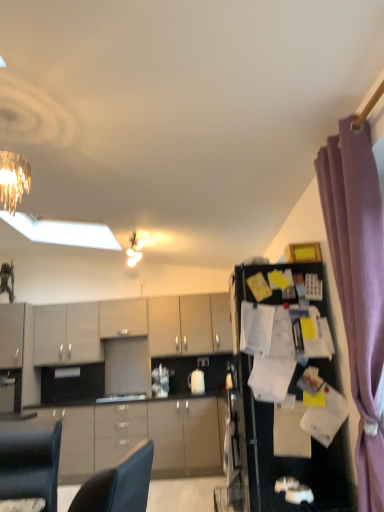
Identify the location of purple fabric curtain at right. This screenshot has width=384, height=512. (358, 287).

The image size is (384, 512). What do you see at coordinates (66, 334) in the screenshot?
I see `matte gray cabinets at center, which is counted as the 3th cabinetry, starting from the top` at bounding box center [66, 334].

At what (x,y) coordinates should I click in order to perform the action: click on glossy wood cabinets at center, the 4th cabinetry in the top-to-bottom sequence. Please return your answer as a coordinate pair (x, y). The image size is (384, 512). Looking at the image, I should click on (140, 436).

Find the location of a particular element. The width and height of the screenshot is (384, 512). white paper at right is located at coordinates (274, 426).

Describe the element at coordinates (133, 251) in the screenshot. This screenshot has height=512, width=384. I see `metallic chandelier at upper center` at that location.

What do you see at coordinates (123, 318) in the screenshot? I see `matte gray cabinet at center, the 4th cabinetry when ordered from bottom to top` at bounding box center [123, 318].

Measure the distance between matte gray cabinet at center, the 4th cabinetry when ordered from bottom to top, and camera.

They are 5.93 meters apart.

This screenshot has width=384, height=512. I want to click on purple fabric curtain at right, so click(x=358, y=287).

Consider the image. Between metallic chandelier at upper center and matte gray cabinet at center, placed as the first cabinetry when sorted from top to bottom, which one is positioned behind?

matte gray cabinet at center, placed as the first cabinetry when sorted from top to bottom.

Is metallic chandelier at upper center with matte gray cabinet at center, the 4th cabinetry when ordered from bottom to top?

metallic chandelier at upper center and matte gray cabinet at center, the 4th cabinetry when ordered from bottom to top, are not in contact.

From the image's perspective, between metallic chandelier at upper center and matte gray cabinet at center, placed as the first cabinetry when sorted from top to bottom, which one is located above?

metallic chandelier at upper center appears higher in the image.

How different are the orientations of metallic chandelier at upper center and matte gray cabinet at center, placed as the first cabinetry when sorted from top to bottom, in degrees?

82.4 degrees separate the facing orientations of metallic chandelier at upper center and matte gray cabinet at center, placed as the first cabinetry when sorted from top to bottom.

From a real-world perspective, which is physically below, purple fabric curtain at right or matte gray cabinets at center, which is counted as the 3th cabinetry, starting from the top?

purple fabric curtain at right is physically lower.

Which object is thinner, purple fabric curtain at right or matte gray cabinets at center, which is the 2th cabinetry from bottom to top?

purple fabric curtain at right.

Does purple fabric curtain at right lie behind matte gray cabinets at center, which is counted as the 3th cabinetry, starting from the top?

No, purple fabric curtain at right is closer to the viewer.

Are purple fabric curtain at right and matte gray cabinets at center, which is the 2th cabinetry from bottom to top, located far from each other?

Yes, purple fabric curtain at right is far from matte gray cabinets at center, which is the 2th cabinetry from bottom to top.

Who is bigger, matte gray cabinets at center, which is the 2th cabinetry from bottom to top, or matte gray cabinets at center, positioned as the 3th cabinetry in bottom-to-top order?

matte gray cabinets at center, positioned as the 3th cabinetry in bottom-to-top order, is bigger.

Which point is more distant from viewer, [38,359] or [168,335]?

The point [168,335] is behind.

Considering the relative sizes of matte gray cabinets at center, which is counted as the 3th cabinetry, starting from the top, and matte gray cabinets at center, positioned as the 3th cabinetry in bottom-to-top order, in the image provided, is matte gray cabinets at center, which is counted as the 3th cabinetry, starting from the top, wider than matte gray cabinets at center, positioned as the 3th cabinetry in bottom-to-top order,?

In fact, matte gray cabinets at center, which is counted as the 3th cabinetry, starting from the top, might be narrower than matte gray cabinets at center, positioned as the 3th cabinetry in bottom-to-top order.

Relative to white paper at right, is matte gray cabinet at center, placed as the first cabinetry when sorted from top to bottom, in front or behind?

Visually, matte gray cabinet at center, placed as the first cabinetry when sorted from top to bottom, is located behind white paper at right.

Is white paper at right inside matte gray cabinet at center, the 4th cabinetry when ordered from bottom to top?

Actually, white paper at right is outside matte gray cabinet at center, the 4th cabinetry when ordered from bottom to top.

From the image's perspective, between matte gray cabinet at center, the 4th cabinetry when ordered from bottom to top, and white paper at right, which one is located above?

matte gray cabinet at center, the 4th cabinetry when ordered from bottom to top, is shown above in the image.

Considering the relative sizes of matte gray cabinets at center, positioned as the 3th cabinetry in bottom-to-top order, and matte gray cabinets at center, which is the 2th cabinetry from bottom to top, in the image provided, is matte gray cabinets at center, positioned as the 3th cabinetry in bottom-to-top order, taller than matte gray cabinets at center, which is the 2th cabinetry from bottom to top,?

Yes, matte gray cabinets at center, positioned as the 3th cabinetry in bottom-to-top order, is taller than matte gray cabinets at center, which is the 2th cabinetry from bottom to top.

Looking at this image, can you confirm if matte gray cabinets at center, positioned as the 3th cabinetry in bottom-to-top order, is positioned to the left of matte gray cabinets at center, which is counted as the 3th cabinetry, starting from the top?

No.

Is matte gray cabinets at center, positioned as the 3th cabinetry in bottom-to-top order, turned away from matte gray cabinets at center, which is counted as the 3th cabinetry, starting from the top?

matte gray cabinets at center, positioned as the 3th cabinetry in bottom-to-top order, does not have its back to matte gray cabinets at center, which is counted as the 3th cabinetry, starting from the top.

Which of these two, matte gray cabinets at center, positioned as the 3th cabinetry in bottom-to-top order, or matte gray cabinets at center, which is counted as the 3th cabinetry, starting from the top, is wider?

Wider between the two is matte gray cabinets at center, positioned as the 3th cabinetry in bottom-to-top order.

Considering the sizes of objects glossy wood cabinets at center, the 4th cabinetry in the top-to-bottom sequence, and matte gray cabinets at center, which is counted as the 3th cabinetry, starting from the top, in the image provided, who is shorter, glossy wood cabinets at center, the 4th cabinetry in the top-to-bottom sequence, or matte gray cabinets at center, which is counted as the 3th cabinetry, starting from the top,?

Standing shorter between the two is matte gray cabinets at center, which is counted as the 3th cabinetry, starting from the top.

From the picture: Can you confirm if glossy wood cabinets at center, which is the 1th cabinetry in bottom-to-top order, is positioned to the right of matte gray cabinets at center, which is counted as the 3th cabinetry, starting from the top?

Indeed, glossy wood cabinets at center, which is the 1th cabinetry in bottom-to-top order, is positioned on the right side of matte gray cabinets at center, which is counted as the 3th cabinetry, starting from the top.

Relative to matte gray cabinets at center, which is the 2th cabinetry from bottom to top, is glossy wood cabinets at center, the 4th cabinetry in the top-to-bottom sequence, in front or behind?

glossy wood cabinets at center, the 4th cabinetry in the top-to-bottom sequence, is in front of matte gray cabinets at center, which is the 2th cabinetry from bottom to top.

Does point (194, 401) lie in front of point (77, 321)?

That is True.

Considering their positions, is purple fabric curtain at right located in front of or behind matte gray cabinets at center, positioned as the 3th cabinetry in bottom-to-top order?

purple fabric curtain at right is positioned closer to the viewer than matte gray cabinets at center, positioned as the 3th cabinetry in bottom-to-top order.

Can we say purple fabric curtain at right lies outside matte gray cabinets at center, positioned as the 3th cabinetry in bottom-to-top order?

Yes.

From the picture: Can you tell me how much purple fabric curtain at right and matte gray cabinets at center, positioned as the 3th cabinetry in bottom-to-top order, differ in facing direction?

They differ by 85.8 degrees in their facing directions.

Where is `light fixture that is above the matte gray cabinet at center, the 4th cabinetry when ordered from bottom to top (from a real-world perspective)`? This screenshot has height=512, width=384. light fixture that is above the matte gray cabinet at center, the 4th cabinetry when ordered from bottom to top (from a real-world perspective) is located at coordinates (133, 251).

Find the location of `curtain on the right side of matte gray cabinets at center, which is the 2th cabinetry from bottom to top`. curtain on the right side of matte gray cabinets at center, which is the 2th cabinetry from bottom to top is located at coordinates (358, 287).

Looking at the image, which one is located further to glossy wood cabinets at center, the 4th cabinetry in the top-to-bottom sequence, matte gray cabinets at center, which is counted as the 3th cabinetry, starting from the top, or metallic chandelier at upper center?

metallic chandelier at upper center lies further to glossy wood cabinets at center, the 4th cabinetry in the top-to-bottom sequence, than the other object.

Looking at the image, which one is located further to matte gray cabinet at center, the 4th cabinetry when ordered from bottom to top, glossy wood cabinets at center, which is the 1th cabinetry in bottom-to-top order, or matte gray cabinets at center, which is the 2th cabinetry from bottom to top?

The object further to matte gray cabinet at center, the 4th cabinetry when ordered from bottom to top, is glossy wood cabinets at center, which is the 1th cabinetry in bottom-to-top order.

Estimate the real-world distances between objects in this image. Which object is closer to purple fabric curtain at right, glossy wood cabinets at center, which is the 1th cabinetry in bottom-to-top order, or white paper at right?

Based on the image, white paper at right appears to be nearer to purple fabric curtain at right.

When comparing their distances from white paper at right, does matte gray cabinets at center, positioned as the 3th cabinetry in bottom-to-top order, or glossy wood cabinets at center, the 4th cabinetry in the top-to-bottom sequence, seem closer?

glossy wood cabinets at center, the 4th cabinetry in the top-to-bottom sequence, is positioned closer to the anchor white paper at right.

When comparing their distances from matte gray cabinets at center, acting as the second cabinetry starting from the top, does purple fabric curtain at right or matte gray cabinets at center, which is the 2th cabinetry from bottom to top, seem further?

purple fabric curtain at right lies further to matte gray cabinets at center, acting as the second cabinetry starting from the top, than the other object.

Looking at the image, which one is located further to matte gray cabinets at center, which is counted as the 3th cabinetry, starting from the top, glossy wood cabinets at center, which is the 1th cabinetry in bottom-to-top order, or metallic chandelier at upper center?

Among the two, metallic chandelier at upper center is located further to matte gray cabinets at center, which is counted as the 3th cabinetry, starting from the top.

When comparing their distances from glossy wood cabinets at center, the 4th cabinetry in the top-to-bottom sequence, does purple fabric curtain at right or matte gray cabinets at center, which is the 2th cabinetry from bottom to top, seem further?

purple fabric curtain at right is positioned further to the anchor glossy wood cabinets at center, the 4th cabinetry in the top-to-bottom sequence.

Considering their positions, is matte gray cabinets at center, acting as the second cabinetry starting from the top, positioned closer to white paper at right than purple fabric curtain at right?

purple fabric curtain at right is positioned closer to the anchor white paper at right.

Find the location of a particular element. light fixture between purple fabric curtain at right and glossy wood cabinets at center, which is the 1th cabinetry in bottom-to-top order, from front to back is located at coordinates (133, 251).

You are a GUI agent. You are given a task and a screenshot of the screen. Output one action in this format:
    pyautogui.click(x=<x>, y=<y>)
    Task: Click on the light fixture between matte gray cabinets at center, which is the 2th cabinetry from bottom to top, and matte gray cabinets at center, positioned as the 3th cabinetry in bottom-to-top order
    This screenshot has height=512, width=384.
    Given the screenshot: What is the action you would take?
    pyautogui.click(x=133, y=251)

Where is `refrigerator located between purple fabric curtain at right and matte gray cabinets at center, which is the 2th cabinetry from bottom to top, in the depth direction`? The height and width of the screenshot is (512, 384). refrigerator located between purple fabric curtain at right and matte gray cabinets at center, which is the 2th cabinetry from bottom to top, in the depth direction is located at coordinates (274, 426).

Image resolution: width=384 pixels, height=512 pixels. I want to click on light fixture between white paper at right and glossy wood cabinets at center, which is the 1th cabinetry in bottom-to-top order, in the front-back direction, so click(133, 251).